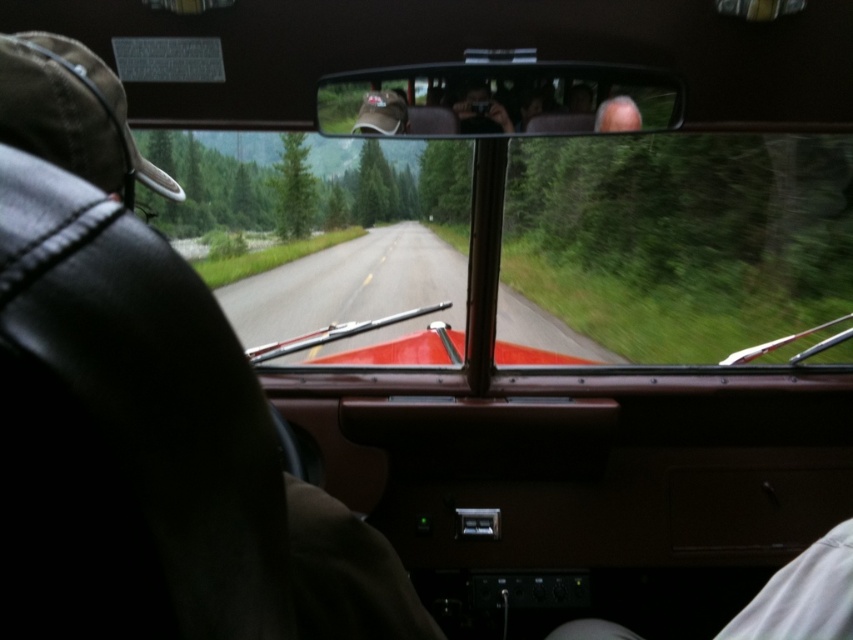
Question: Which point is closer to the camera taking this photo?

Choices:
 (A) (581, 129)
 (B) (352, 186)

Answer: (A)

Question: Can you confirm if transparent glass windshield at center is bigger than matte brown leather view mirror at upper center?

Choices:
 (A) yes
 (B) no

Answer: (A)

Question: Is transparent glass windshield at center in front of matte brown leather view mirror at upper center?

Choices:
 (A) no
 (B) yes

Answer: (B)

Question: Is transparent glass windshield at center to the left of matte brown leather view mirror at upper center from the viewer's perspective?

Choices:
 (A) no
 (B) yes

Answer: (B)